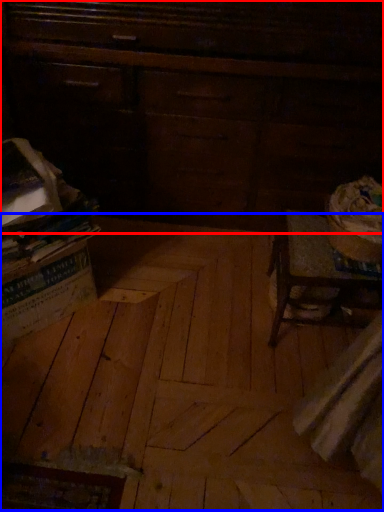
Question: Which object appears closest to the camera in this image, furniture (highlighted by a red box) or plywood (highlighted by a blue box)?

Choices:
 (A) furniture
 (B) plywood

Answer: (B)